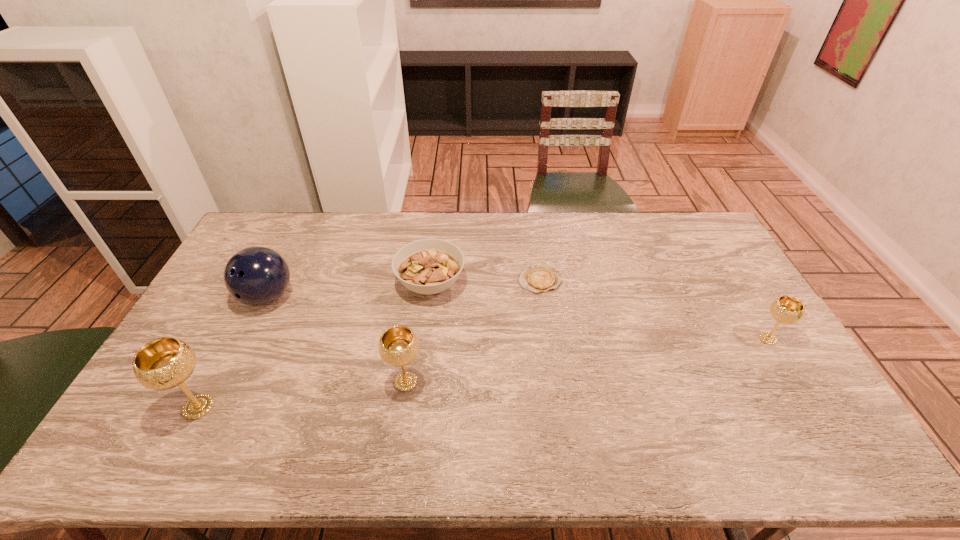
This screenshot has height=540, width=960. What are the coordinates of `the tallest object` in the screenshot? It's located at (164, 363).

At what (x,y) coordinates should I click in order to perform the action: click on the leftmost chalice. Please return your answer as a coordinate pair (x, y). This screenshot has width=960, height=540. Looking at the image, I should click on (164, 363).

Find the location of a particular element. The image size is (960, 540). the second tallest chalice is located at coordinates (398, 346).

Where is `the shortest chalice`? This screenshot has width=960, height=540. the shortest chalice is located at coordinates (788, 310).

This screenshot has height=540, width=960. In order to click on the third nearest object in this screenshot , I will do `click(788, 310)`.

Locate an element on the screen. This screenshot has width=960, height=540. stew is located at coordinates (428, 266).

You are a GUI agent. You are given a task and a screenshot of the screen. Output one action in this format:
    pyautogui.click(x=<x>, y=<y>)
    Task: Click on the shortest object
    
    Given the screenshot: What is the action you would take?
    pyautogui.click(x=538, y=279)

Identify the location of the fifth object from left to right. (538, 279).

Locate an element on the screen. bowling ball is located at coordinates (255, 276).

Image resolution: width=960 pixels, height=540 pixels. In order to click on blank space located 0.140m on the back of the tallest chalice in this screenshot , I will do `click(230, 346)`.